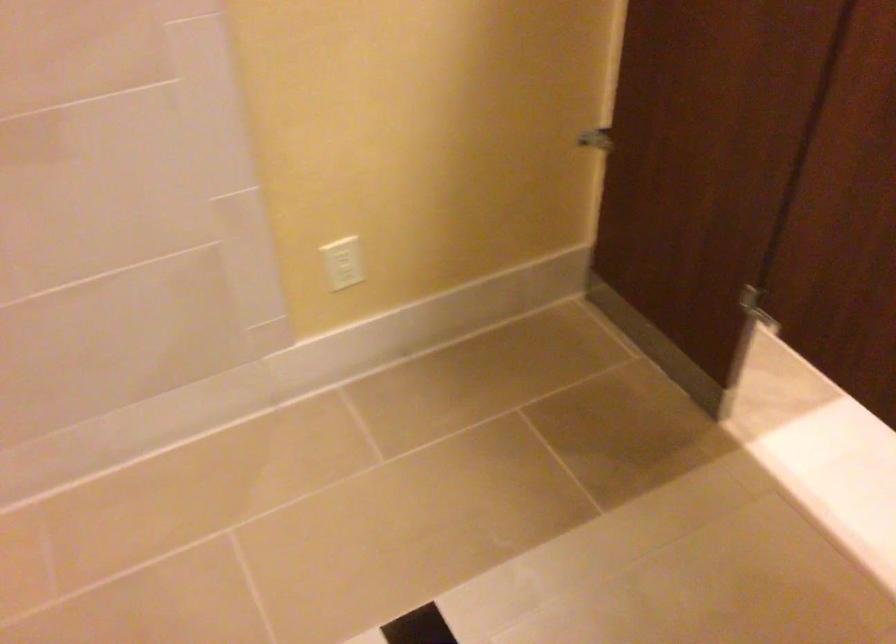
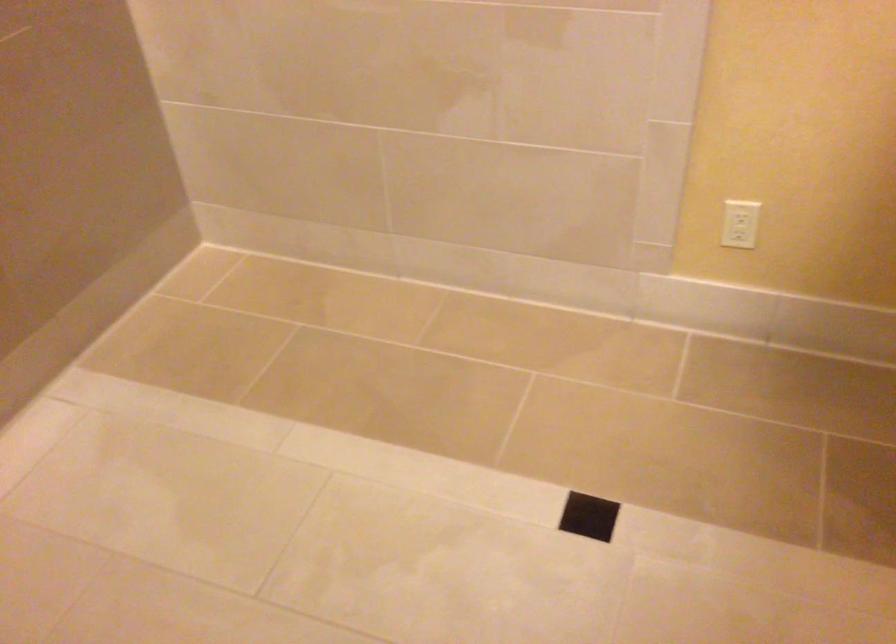
Locate, in the second image, the point that corresponds to (x=357, y=263) in the first image.

(739, 223)